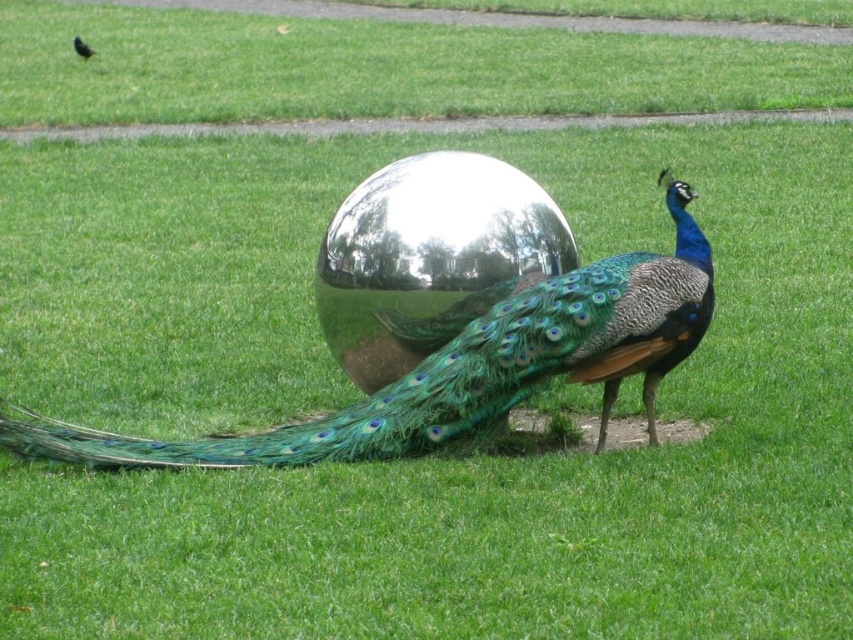
Question: Among these points, which one is farthest from the camera?

Choices:
 (A) (80, 44)
 (B) (476, 228)
 (C) (543, 324)

Answer: (A)

Question: Is shiny metallic peacock at center bigger than matte black peacock at center?

Choices:
 (A) no
 (B) yes

Answer: (B)

Question: Which of the following is the closest to the observer?

Choices:
 (A) matte black peacock at center
 (B) shiny metallic sphere at center

Answer: (B)

Question: Which point is farther to the camera?

Choices:
 (A) shiny metallic peacock at center
 (B) shiny metallic sphere at center

Answer: (B)

Question: In this image, where is shiny metallic sphere at center located relative to matte black peacock at center?

Choices:
 (A) right
 (B) left

Answer: (A)

Question: Can you confirm if shiny metallic peacock at center is bigger than matte black peacock at center?

Choices:
 (A) no
 (B) yes

Answer: (B)